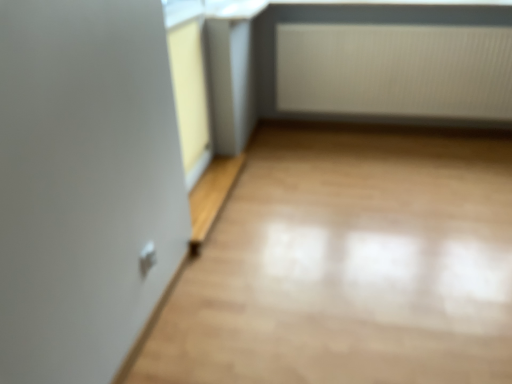
Question: Is yellow matte window frame at upper left to the right of white textured radiator at upper right from the viewer's perspective?

Choices:
 (A) no
 (B) yes

Answer: (A)

Question: From a real-world perspective, is yellow matte window frame at upper left under white textured radiator at upper right?

Choices:
 (A) no
 (B) yes

Answer: (A)

Question: From a real-world perspective, is yellow matte window frame at upper left on top of white textured radiator at upper right?

Choices:
 (A) yes
 (B) no

Answer: (A)

Question: From the image's perspective, is yellow matte window frame at upper left on white textured radiator at upper right?

Choices:
 (A) no
 (B) yes

Answer: (A)

Question: Is yellow matte window frame at upper left thinner than white textured radiator at upper right?

Choices:
 (A) no
 (B) yes

Answer: (B)

Question: Is yellow matte window frame at upper left smaller than white textured radiator at upper right?

Choices:
 (A) no
 (B) yes

Answer: (B)

Question: Is white textured radiator at upper right next to yellow matte window frame at upper left and touching it?

Choices:
 (A) yes
 (B) no

Answer: (B)

Question: Considering the relative positions of white textured radiator at upper right and yellow matte window frame at upper left in the image provided, is white textured radiator at upper right to the left of yellow matte window frame at upper left from the viewer's perspective?

Choices:
 (A) no
 (B) yes

Answer: (A)

Question: Does white textured radiator at upper right have a larger size compared to yellow matte window frame at upper left?

Choices:
 (A) yes
 (B) no

Answer: (A)

Question: Could you tell me if white textured radiator at upper right is turned towards yellow matte window frame at upper left?

Choices:
 (A) yes
 (B) no

Answer: (A)

Question: Does white textured radiator at upper right have a greater width compared to yellow matte window frame at upper left?

Choices:
 (A) yes
 (B) no

Answer: (A)

Question: Does white textured radiator at upper right have a lesser width compared to yellow matte window frame at upper left?

Choices:
 (A) yes
 (B) no

Answer: (B)

Question: Which is correct: white textured radiator at upper right is inside yellow matte window frame at upper left, or outside of it?

Choices:
 (A) inside
 (B) outside

Answer: (B)